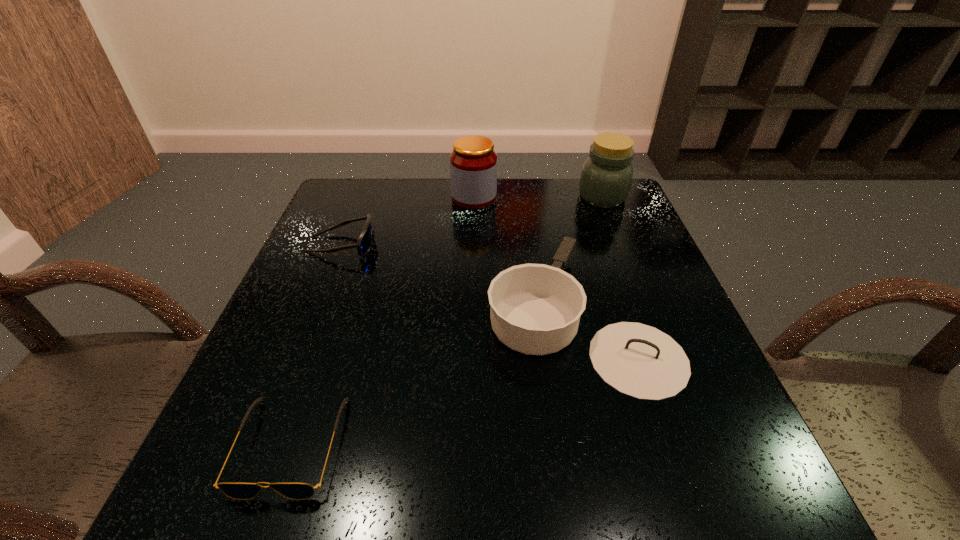
You are a GUI agent. You are given a task and a screenshot of the screen. Output one action in this format:
    pyautogui.click(x=<x>, y=<y>)
    Task: Click on the empty location between the left jar and the saucepan
    
    Given the screenshot: What is the action you would take?
    pyautogui.click(x=526, y=256)

Locate an element on the screen. This screenshot has height=540, width=960. free point between the right jar and the taller sunglasses is located at coordinates (471, 221).

Where is `the second closest object to the right jar`? Image resolution: width=960 pixels, height=540 pixels. the second closest object to the right jar is located at coordinates (473, 162).

Locate an element on the screen. The height and width of the screenshot is (540, 960). object that stands as the fourth closest to the taller sunglasses is located at coordinates (606, 176).

Locate an element on the screen. free space that satisfies the following two spatial constraints: 1. on the back side of the third tallest object; 2. on the front-facing side of the farther sunglasses is located at coordinates (562, 245).

Identify the location of blank area in the image that satisfies the following two spatial constraints: 1. on the front side of the right jar; 2. on the front-facing side of the taller sunglasses. The height and width of the screenshot is (540, 960). (621, 245).

At what (x,y) coordinates should I click in order to perform the action: click on vacant space that satisfies the following two spatial constraints: 1. on the back side of the saucepan; 2. on the front-facing side of the taller sunglasses. Please return your answer as a coordinate pair (x, y). The image size is (960, 540). Looking at the image, I should click on (562, 245).